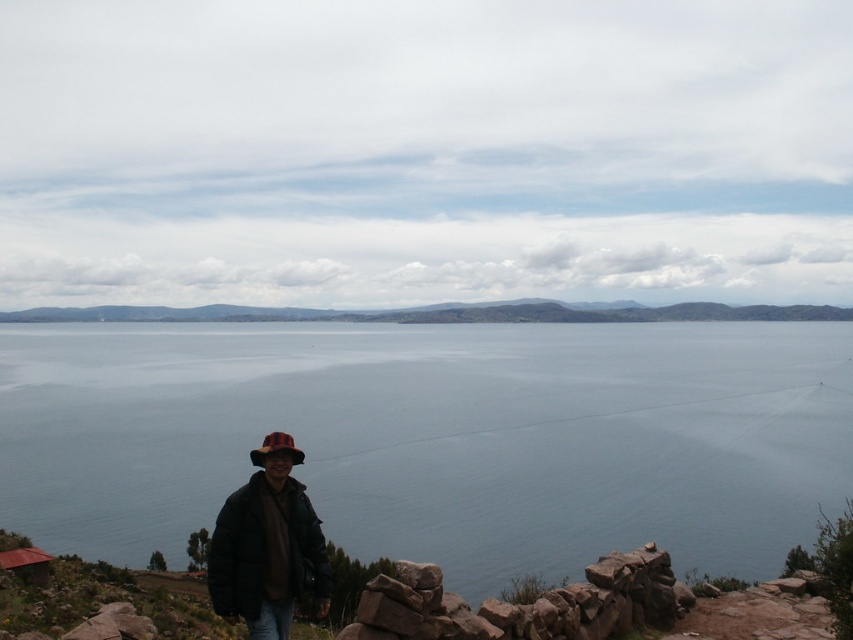
Based on the coordinates provided, which object in the scene is located at point (436, 436)?

The point (436, 436) corresponds to the blue water at center.

You are a photographer trying to capture the blue water at center and the red felt hat at lower center in a single shot. Based on their positions, which object will appear larger in the photo?

The blue water at center will appear larger in the photo because it is much taller than the red felt hat at lower center.